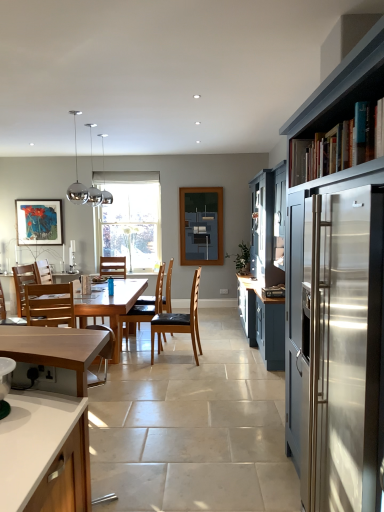
Question: Should I look upward or downward to see brown leather chair at center, arranged as the second chair when viewed from the back?

Choices:
 (A) up
 (B) down

Answer: (B)

Question: Is the position of light brown wooden chair at center, which ranks as the fourth chair in back-to-front order, less distant than that of wooden chair at center, which is the 1th chair in back-to-front order?

Choices:
 (A) yes
 (B) no

Answer: (A)

Question: From the image's perspective, is light brown wooden chair at center, which ranks as the 2th chair in front-to-back order, under wooden chair at center, which is the 1th chair in back-to-front order?

Choices:
 (A) yes
 (B) no

Answer: (A)

Question: Is light brown wooden chair at center, which ranks as the 2th chair in front-to-back order, facing towards wooden chair at center, which is the 1th chair in back-to-front order?

Choices:
 (A) no
 (B) yes

Answer: (A)

Question: From a real-world perspective, is light brown wooden chair at center, which ranks as the fourth chair in back-to-front order, physically above wooden chair at center, the fifth chair viewed from the front?

Choices:
 (A) yes
 (B) no

Answer: (B)

Question: Is light brown wooden chair at center, which ranks as the 2th chair in front-to-back order, behind wooden chair at center, the fifth chair viewed from the front?

Choices:
 (A) yes
 (B) no

Answer: (B)

Question: Is wooden chair at center, the fifth chair viewed from the front, inside light brown wooden chair at center, which ranks as the fourth chair in back-to-front order?

Choices:
 (A) no
 (B) yes

Answer: (A)

Question: Is matte black artwork at center far away from light brown wood countertop at lower left, the 2th cabinetry from the right?

Choices:
 (A) yes
 (B) no

Answer: (A)

Question: From a real-world perspective, is matte black artwork at center under light brown wood countertop at lower left, arranged as the 1th cabinetry when viewed from the left?

Choices:
 (A) no
 (B) yes

Answer: (A)

Question: Is matte black artwork at center looking in the opposite direction of light brown wood countertop at lower left, arranged as the 1th cabinetry when viewed from the left?

Choices:
 (A) no
 (B) yes

Answer: (A)

Question: Does matte black artwork at center have a greater width compared to light brown wood countertop at lower left, arranged as the 1th cabinetry when viewed from the left?

Choices:
 (A) yes
 (B) no

Answer: (B)

Question: Does matte black artwork at center touch light brown wood countertop at lower left, the 2th cabinetry from the right?

Choices:
 (A) yes
 (B) no

Answer: (B)

Question: Does matte black artwork at center appear on the right side of light brown wood countertop at lower left, the 2th cabinetry from the right?

Choices:
 (A) yes
 (B) no

Answer: (A)

Question: Is the depth of blue painted wood bookshelf at upper right less than that of brown leather chair at center?

Choices:
 (A) yes
 (B) no

Answer: (A)